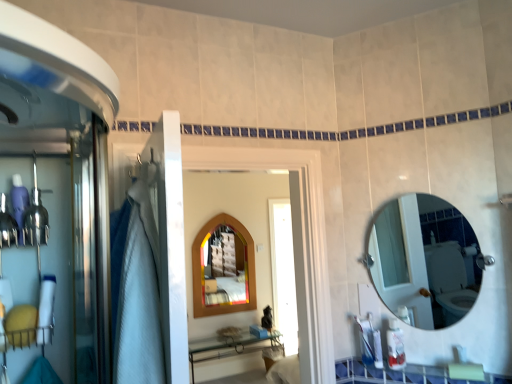
Question: Considering the relative positions of wooden stained mirror at center, the first mirror in the back-to-front sequence, and white glossy counter top at lower center in the image provided, is wooden stained mirror at center, the first mirror in the back-to-front sequence, to the left of white glossy counter top at lower center from the viewer's perspective?

Choices:
 (A) yes
 (B) no

Answer: (A)

Question: Considering the relative sizes of wooden stained mirror at center, the first mirror in the back-to-front sequence, and white glossy counter top at lower center in the image provided, is wooden stained mirror at center, the first mirror in the back-to-front sequence, shorter than white glossy counter top at lower center?

Choices:
 (A) no
 (B) yes

Answer: (A)

Question: Can you confirm if wooden stained mirror at center, the first mirror in the back-to-front sequence, is smaller than white glossy counter top at lower center?

Choices:
 (A) yes
 (B) no

Answer: (B)

Question: Is wooden stained mirror at center, the second mirror from the right, at the right side of white glossy counter top at lower center?

Choices:
 (A) no
 (B) yes

Answer: (A)

Question: Is wooden stained mirror at center, the second mirror from the right, looking in the opposite direction of white glossy counter top at lower center?

Choices:
 (A) no
 (B) yes

Answer: (A)

Question: From a real-world perspective, is wooden stained mirror at center, the first mirror in the back-to-front sequence, positioned over white glossy counter top at lower center based on gravity?

Choices:
 (A) yes
 (B) no

Answer: (A)

Question: From the image's perspective, is wooden arched mirror at center below clear glass mirror at upper right, the first mirror positioned from the right?

Choices:
 (A) yes
 (B) no

Answer: (A)

Question: Is wooden arched mirror at center at the left side of clear glass mirror at upper right, the first mirror positioned from the right?

Choices:
 (A) yes
 (B) no

Answer: (A)

Question: Does wooden arched mirror at center come in front of clear glass mirror at upper right, which appears as the 1th mirror when viewed from the front?

Choices:
 (A) no
 (B) yes

Answer: (B)

Question: Is wooden arched mirror at center further to camera compared to clear glass mirror at upper right, the first mirror positioned from the right?

Choices:
 (A) no
 (B) yes

Answer: (A)

Question: From a real-world perspective, is wooden arched mirror at center physically above clear glass mirror at upper right, the 2th mirror positioned from the left?

Choices:
 (A) yes
 (B) no

Answer: (B)

Question: Would you say wooden arched mirror at center contains clear glass mirror at upper right, the 2th mirror positioned from the left?

Choices:
 (A) no
 (B) yes

Answer: (A)

Question: Can you see wooden stained mirror at center, which appears as the first mirror when viewed from the left, touching wooden arched mirror at center?

Choices:
 (A) no
 (B) yes

Answer: (A)